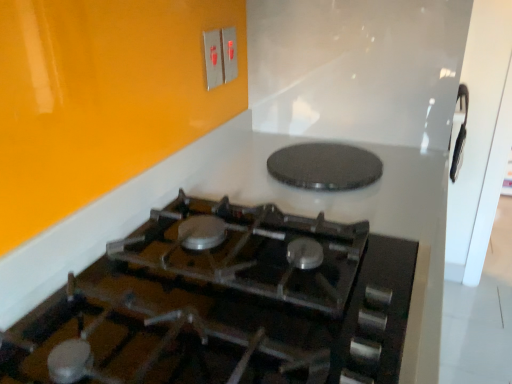
Question: From a real-world perspective, relative to metallic switch at upper center, which is counted as the first electric outlet, starting from the left, is metallic silver switch at upper center, placed as the 1th electric outlet when sorted from right to left, vertically above or below?

Choices:
 (A) above
 (B) below

Answer: (B)

Question: Does point (234, 49) appear closer or farther from the camera than point (216, 49)?

Choices:
 (A) farther
 (B) closer

Answer: (A)

Question: Which object is the closest to the metallic switch at upper center, which is the 2th electric outlet from right to left?

Choices:
 (A) black textured pizza pan at upper center
 (B) black glass gas stove at center
 (C) metallic silver switch at upper center, marked as the 2th electric outlet in a left-to-right arrangement

Answer: (C)

Question: Which object is the closest to the metallic silver switch at upper center, placed as the 1th electric outlet when sorted from right to left?

Choices:
 (A) metallic switch at upper center, which is the 2th electric outlet from right to left
 (B) black textured pizza pan at upper center
 (C) black glass gas stove at center

Answer: (A)